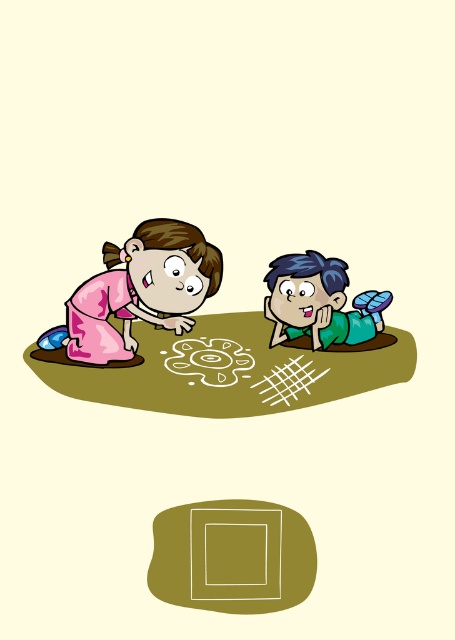
Can you confirm if pink fabric dress at left is wider than white chalk drawing at center?

Yes, pink fabric dress at left is wider than white chalk drawing at center.

The width and height of the screenshot is (455, 640). Describe the element at coordinates (137, 292) in the screenshot. I see `pink fabric dress at left` at that location.

Which is behind, point (106, 323) or point (186, 340)?

Positioned behind is point (186, 340).

Where is `pink fabric dress at left`? Image resolution: width=455 pixels, height=640 pixels. pink fabric dress at left is located at coordinates (137, 292).

Which is below, smooth olive square at center or white chalk drawing at center?

smooth olive square at center

Can you confirm if smooth olive square at center is thinner than white chalk drawing at center?

Incorrect, smooth olive square at center's width is not less than white chalk drawing at center's.

This screenshot has width=455, height=640. Identify the location of smooth olive square at center. point(232,556).

Can you confirm if smooth olive square at center is bigger than pink fabric dress at left?

No.

Between point (217, 518) and point (175, 248), which one is positioned in front?

Point (175, 248) is in front.

Identify the location of smooth olive square at center. (232, 556).